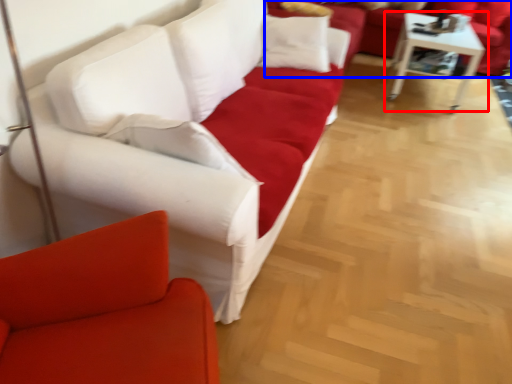
Question: Among these objects, which one is farthest to the camera, table (highlighted by a red box) or studio couch (highlighted by a blue box)?

Choices:
 (A) table
 (B) studio couch

Answer: (B)